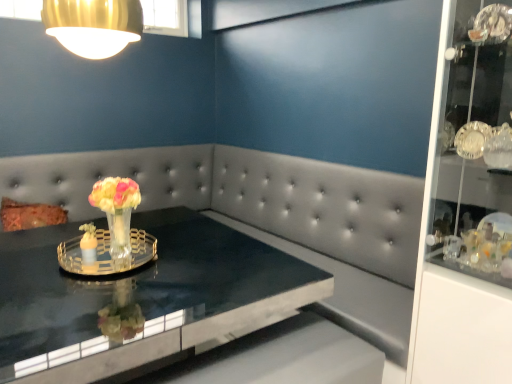
The width and height of the screenshot is (512, 384). I want to click on free spot in front of clear glass tray at center, so click(x=94, y=306).